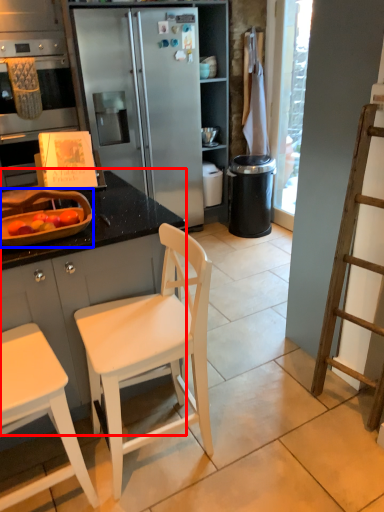
Question: Which of the following is the closest to the observer, cabinetry (highlighted by a red box) or appliance (highlighted by a blue box)?

Choices:
 (A) cabinetry
 (B) appliance

Answer: (A)